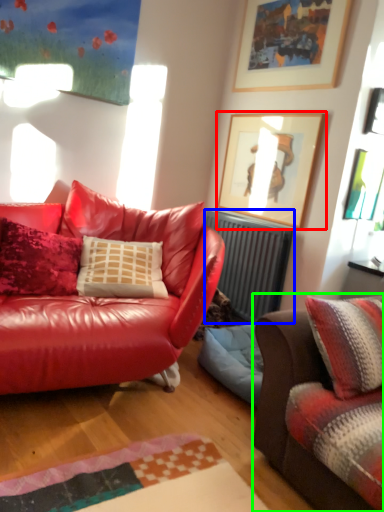
Question: Which object is positioned closest to picture frame (highlighted by a red box)? Select from radiator (highlighted by a blue box) and studio couch (highlighted by a green box).

Choices:
 (A) radiator
 (B) studio couch

Answer: (A)